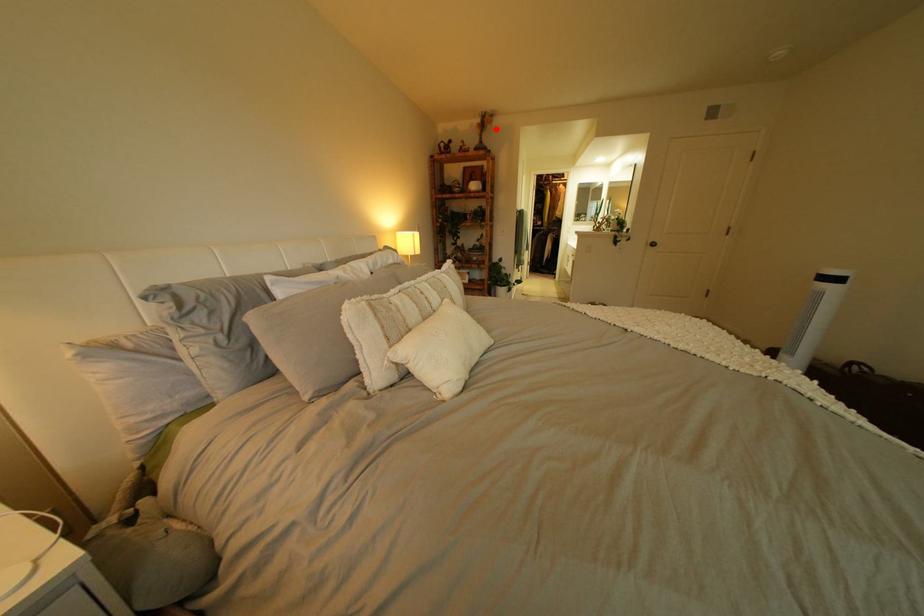
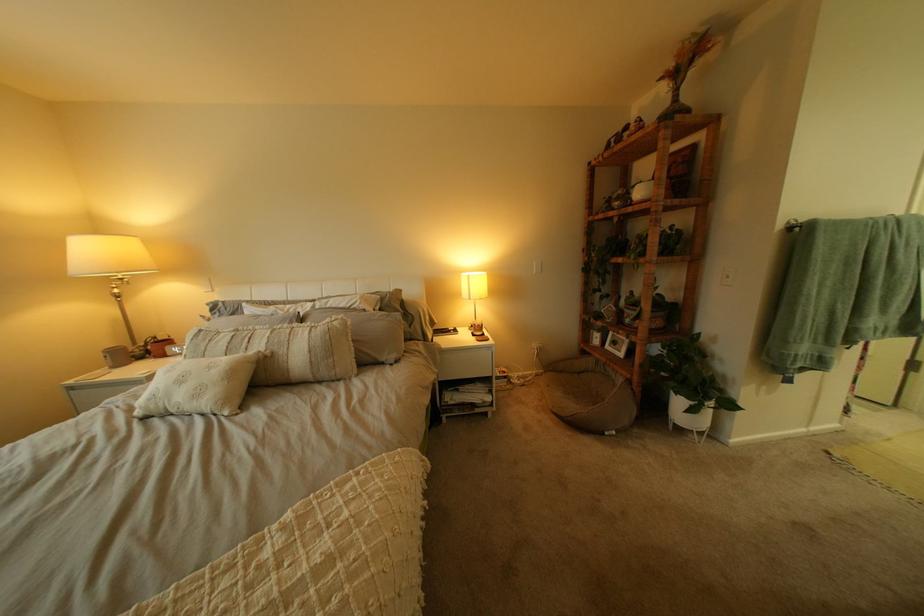
Question: I am providing you with two images of the same scene from different viewpoints. In image1, a red point is highlighted. Considering the same 3D point in image2, which of the following is correct?

Choices:
 (A) It is closer
 (B) It is farther

Answer: (B)